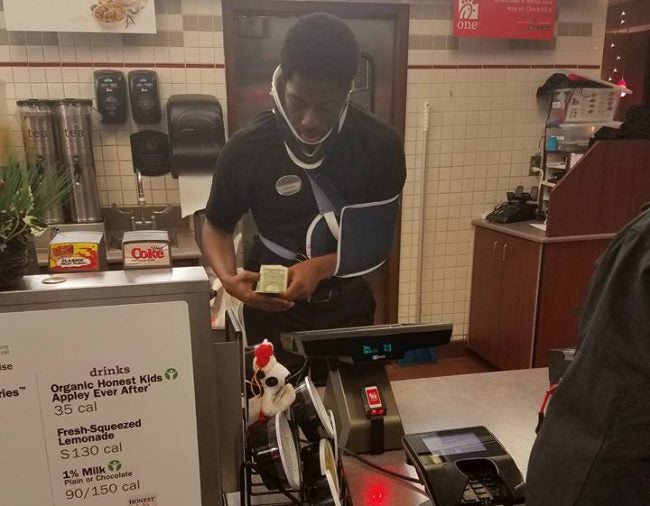
Locate an element on the screen. The width and height of the screenshot is (650, 506). soap dispenser is located at coordinates (114, 104), (148, 102).